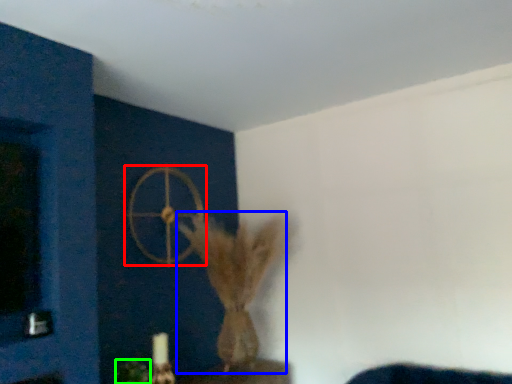
Question: Based on their relative distances, which object is farther from wheel (highlighted by a red box)? Choose from animal (highlighted by a blue box) and plant (highlighted by a green box).

Choices:
 (A) animal
 (B) plant

Answer: (B)